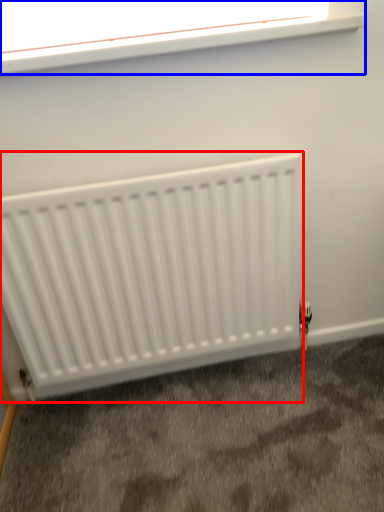
Question: Which object is closer to the camera taking this photo, radiator (highlighted by a red box) or window (highlighted by a blue box)?

Choices:
 (A) radiator
 (B) window

Answer: (B)